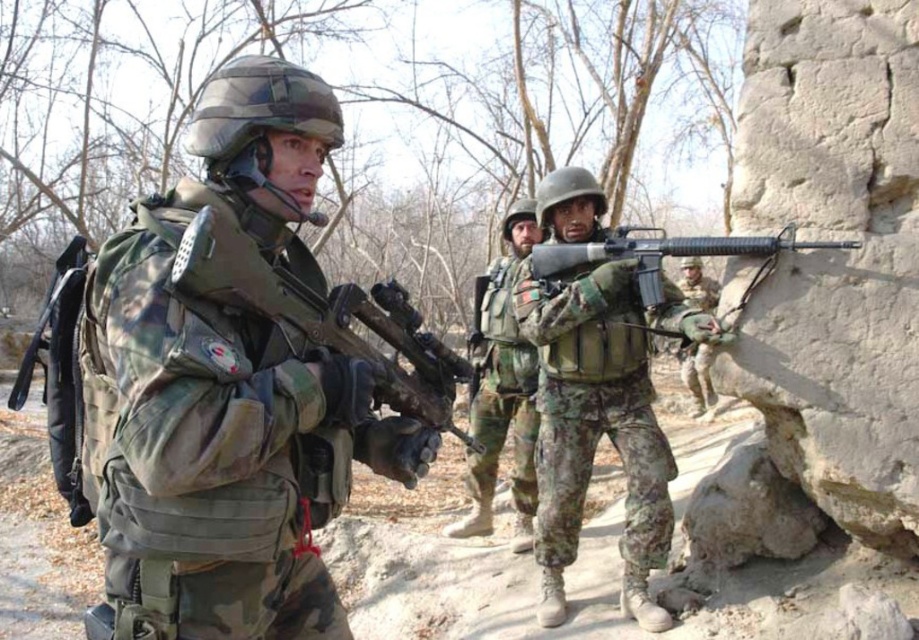
Question: Can you confirm if camouflage fabric rifle at center is positioned below matte black rifle at center?

Choices:
 (A) no
 (B) yes

Answer: (B)

Question: Does camouflage fabric rifle at center lie behind matte black rifle at center?

Choices:
 (A) no
 (B) yes

Answer: (B)

Question: Does camouflage fabric helmet at center appear on the left side of matte black rifle at center?

Choices:
 (A) no
 (B) yes

Answer: (B)

Question: Which object appears farthest from the camera in this image?

Choices:
 (A) camo uniform at center
 (B) camouflage fabric helmet at center
 (C) camouflage fabric helmet at lower right

Answer: (B)

Question: Which object is closer to the camera taking this photo?

Choices:
 (A) camouflage fabric helmet at center
 (B) matte black rifle at center

Answer: (B)

Question: Which point is closer to the camera?

Choices:
 (A) camouflage fabric helmet at center
 (B) camouflage fabric helmet at lower right
 (C) camouflage fabric rifle at center
 (D) camo uniform at center

Answer: (D)